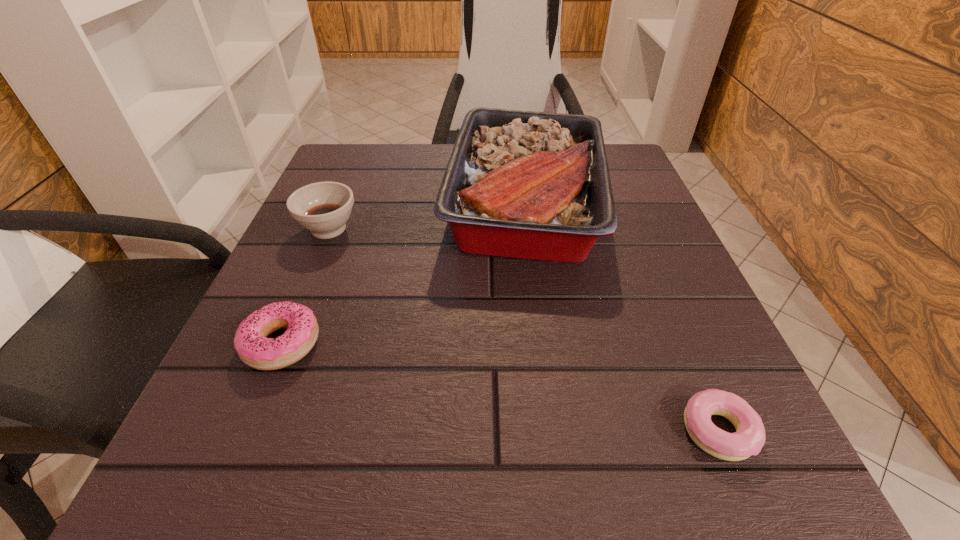
At what (x,y) coordinates should I click in order to perform the action: click on free spot at the right edge of the desktop. Please return your answer as a coordinate pair (x, y). Looking at the image, I should click on (621, 306).

Locate an element on the screen. This screenshot has width=960, height=540. blank area at the far left corner is located at coordinates (376, 194).

Where is `free space at the near left corner`? The height and width of the screenshot is (540, 960). free space at the near left corner is located at coordinates (229, 448).

The width and height of the screenshot is (960, 540). I want to click on vacant space that is in between the left doughnut and the second tallest object, so pos(305,286).

Image resolution: width=960 pixels, height=540 pixels. In order to click on free space between the farther doughnut and the shorter doughnut in this screenshot , I will do `click(499, 388)`.

The width and height of the screenshot is (960, 540). In order to click on vacant space that is in between the nearest object and the second tallest object in this screenshot , I will do `click(523, 330)`.

Where is `free space that is in between the third farthest object and the nearest object`? This screenshot has height=540, width=960. free space that is in between the third farthest object and the nearest object is located at coordinates (499, 388).

This screenshot has height=540, width=960. Find the location of `free space between the farther doughnut and the shorter doughnut`. free space between the farther doughnut and the shorter doughnut is located at coordinates (499, 388).

Find the location of a particular element. This screenshot has height=540, width=960. free area in between the nearest object and the tallest object is located at coordinates (621, 316).

Where is `blank region between the tray and the right doughnut`? This screenshot has width=960, height=540. blank region between the tray and the right doughnut is located at coordinates (621, 316).